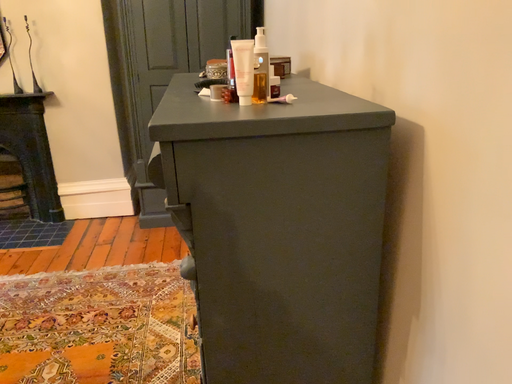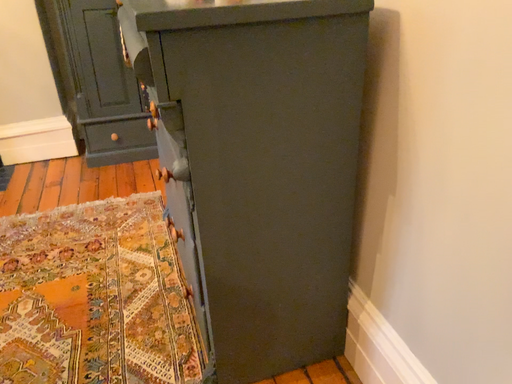
Question: Which way did the camera rotate in the video?

Choices:
 (A) rotated downward
 (B) rotated upward

Answer: (A)